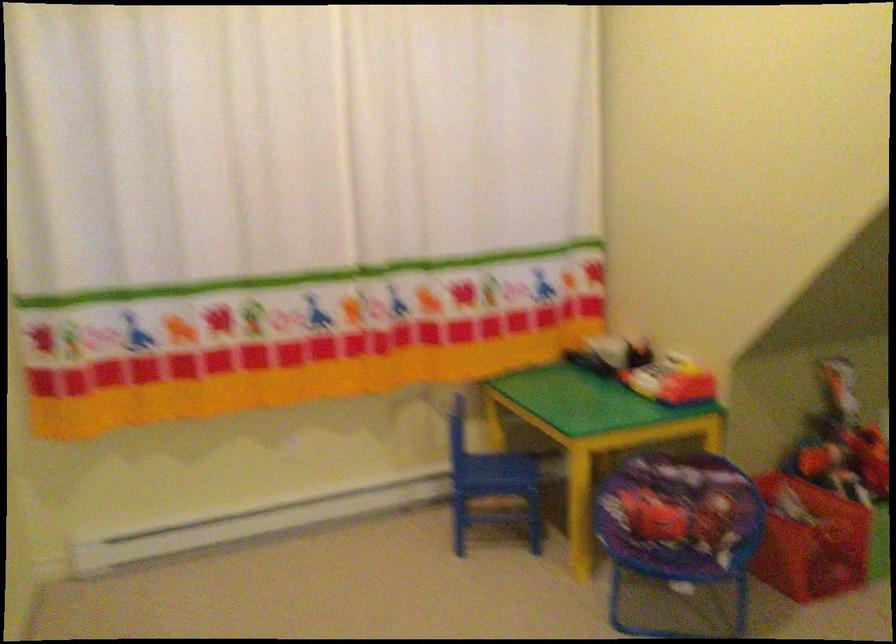
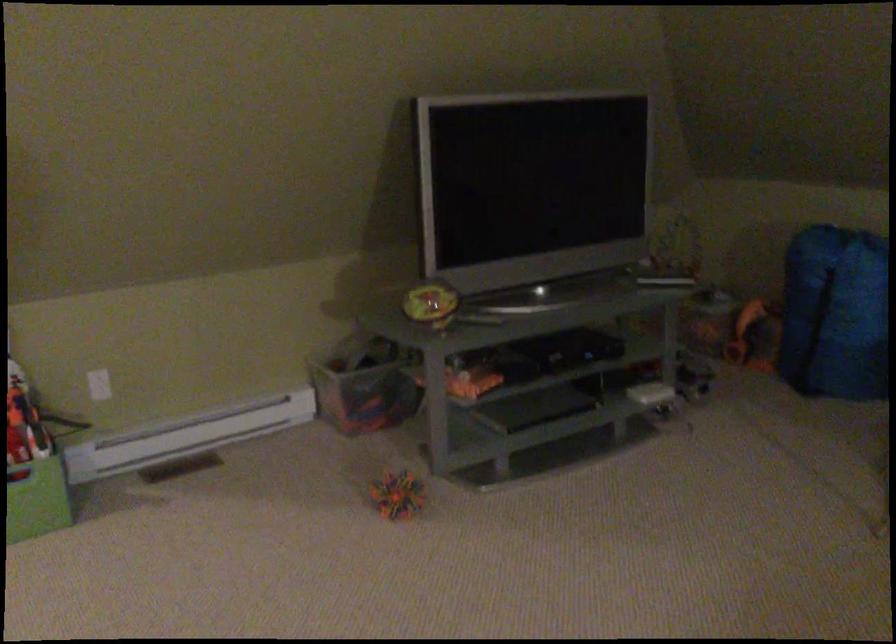
Question: What movement of the cameraman would produce the second image?

Choices:
 (A) Left
 (B) Right
 (C) Forward
 (D) Backward

Answer: (B)